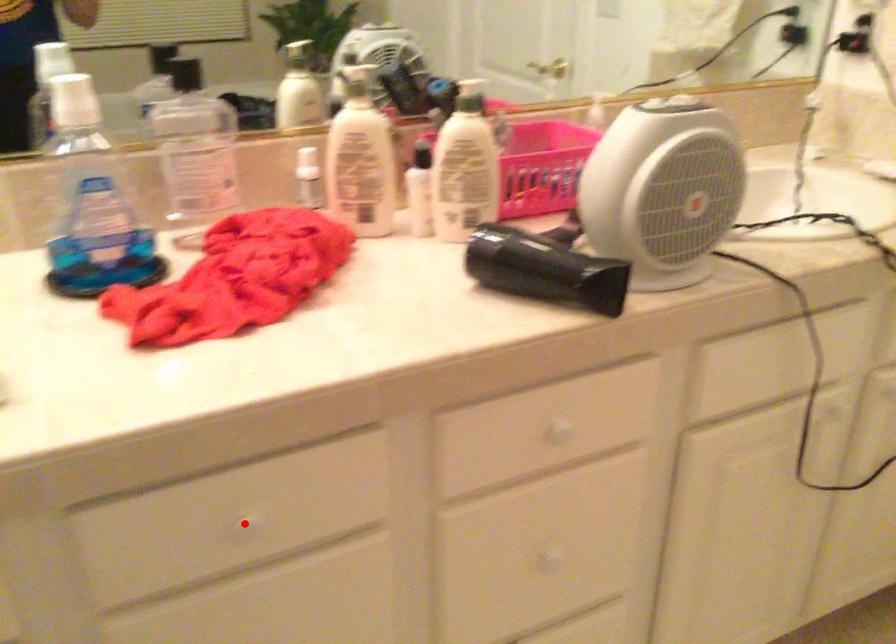
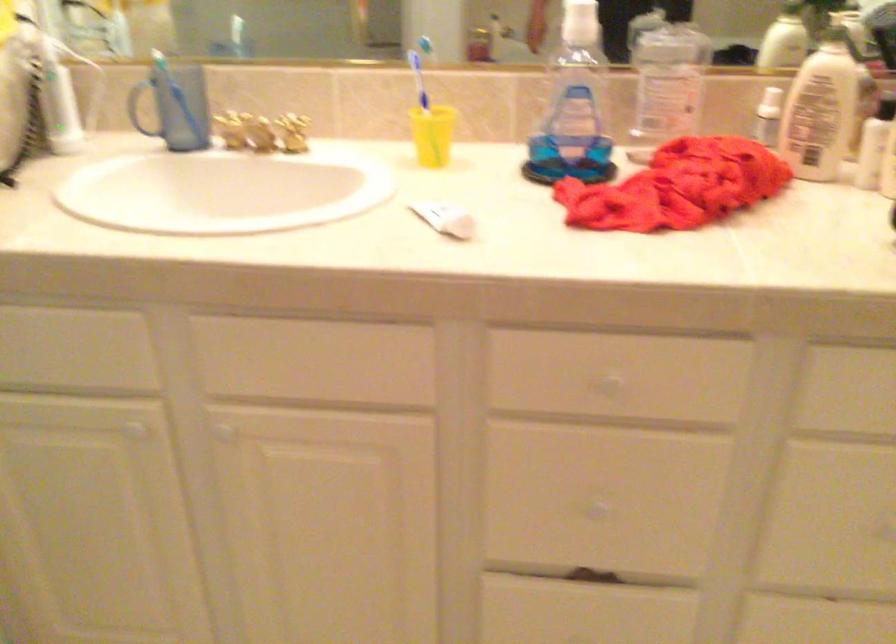
Question: I am providing you with two images of the same scene from different viewpoints. In image1, a red point is highlighted. Considering the same 3D point in image2, which of the following is correct?

Choices:
 (A) It is closer
 (B) It is farther

Answer: (B)